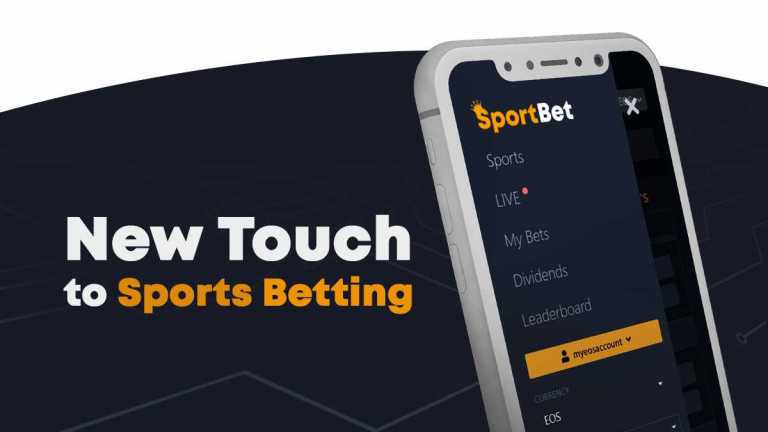
Locate an element on the screen. speaker is located at coordinates (554, 62).